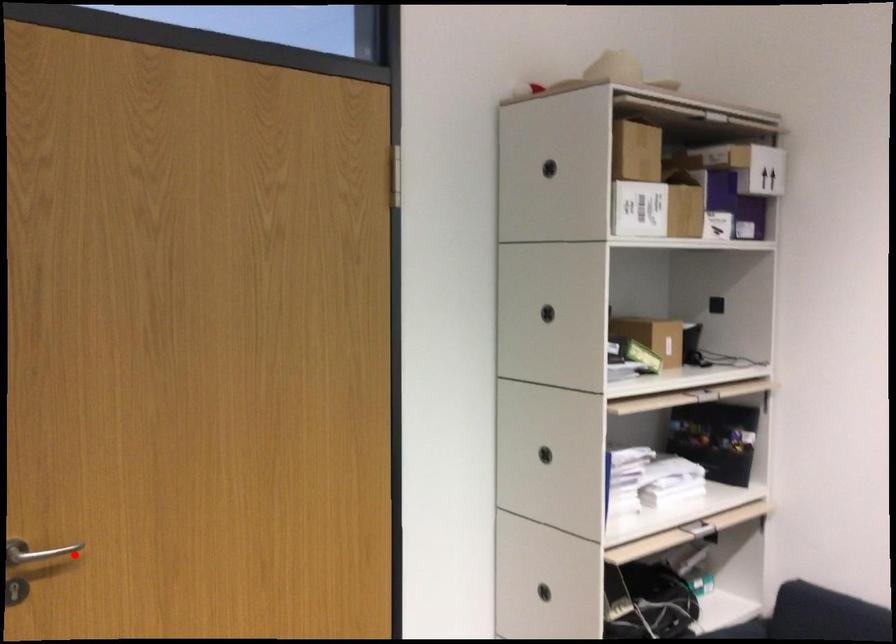
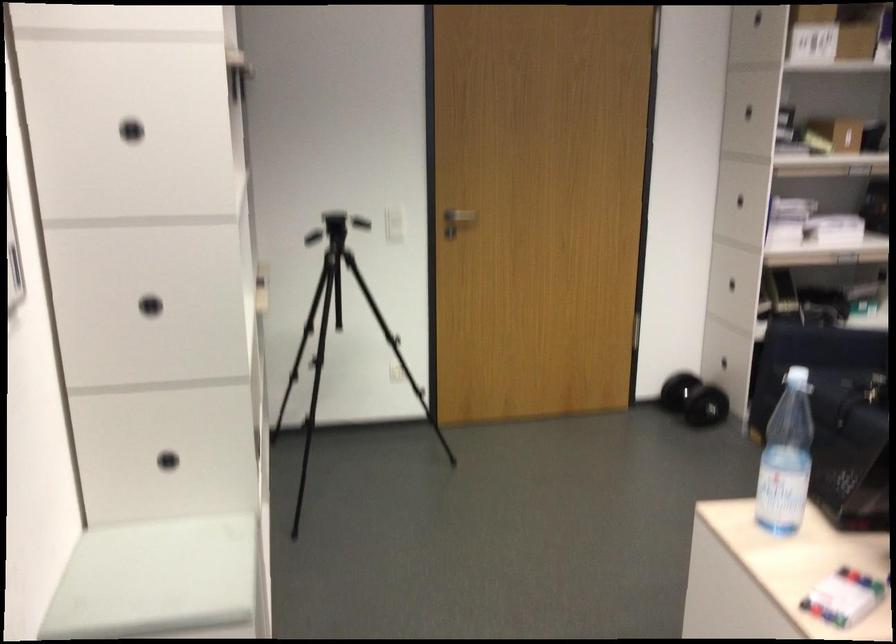
Where in the second image is the point corresponding to the highlighted location from the first image?

(460, 216)